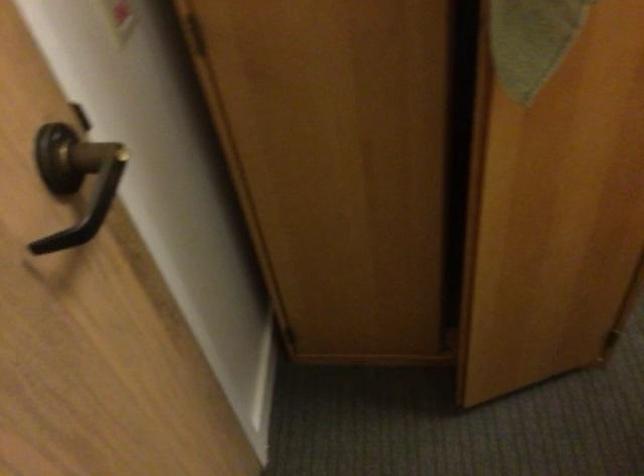
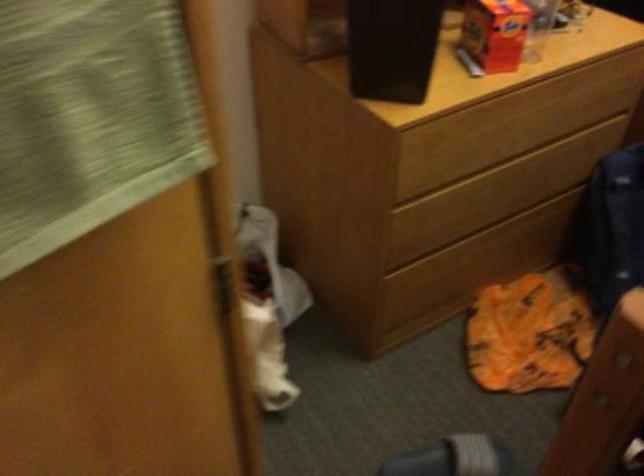
Question: Based on the continuous images, in which direction is the camera rotating? Reply with the corresponding letter.

Choices:
 (A) Left
 (B) Right
 (C) Up
 (D) Down

Answer: (B)